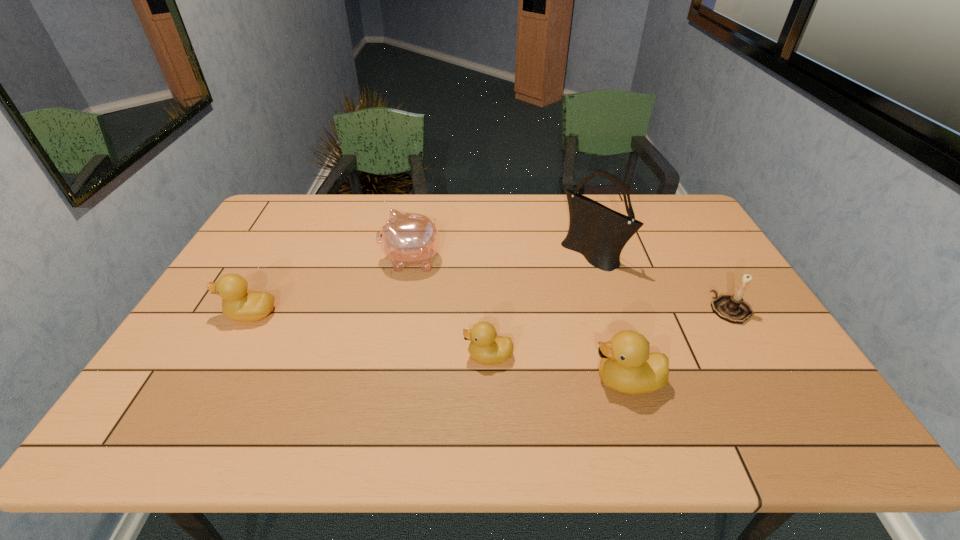
If we want them evenly spaced by inserting an extra duckling among them, please locate a free spot for this new duckling. Please provide its 2D coordinates. Your answer should be formatted as a tuple, i.e. [(x, y)], where the tuple contains the x and y coordinates of a point satisfying the conditions above.

[(364, 334)]